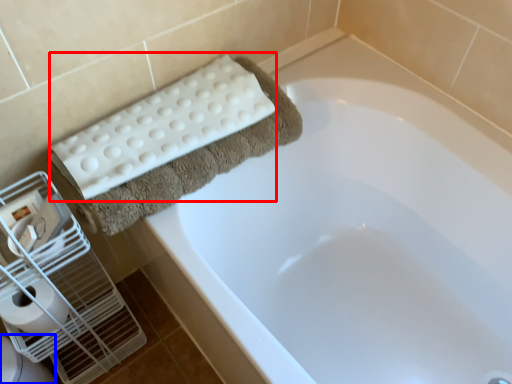
Question: Which point is further to the camera, bath towel (highlighted by a red box) or toilet bowl (highlighted by a blue box)?

Choices:
 (A) bath towel
 (B) toilet bowl

Answer: (B)